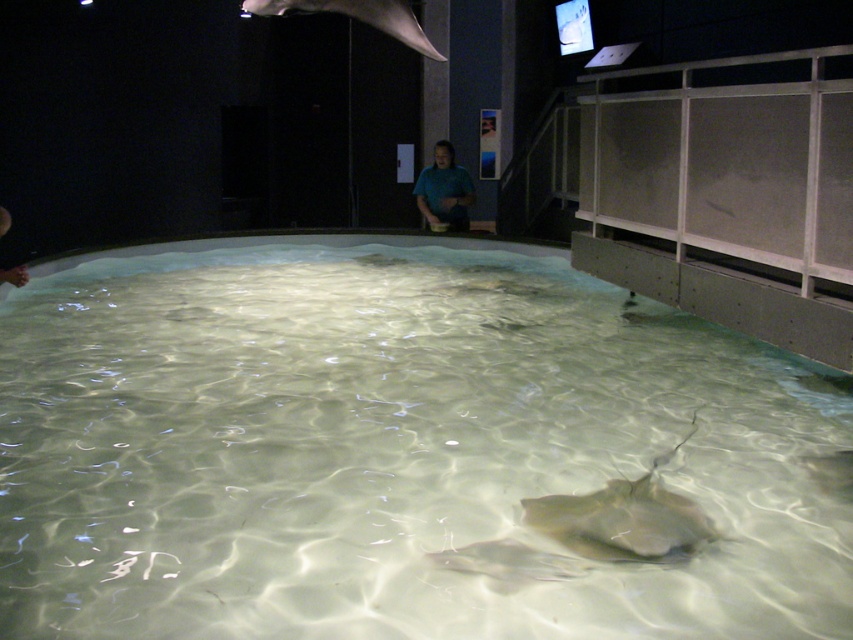
You are a marine biologist observing the aquarium. You notice two stingrays in the pool. Which stingray, the translucent white stingray at center or the smooth gray stingray at upper center, is closer to the bottom of the pool?

The translucent white stingray at center is closer to the bottom of the pool because it has a lesser height compared to the smooth gray stingray at upper center.

You are a visitor at the aquarium and want to take a photo of the translucent white stingray at center through the clear glass swimming pool at center. Since the pool is bigger, will you need to adjust your camera focus to capture the stingray clearly?

The clear glass swimming pool at center is bigger than the translucent white stingray at center, so you will need to adjust your camera focus to ensure the stingray is in focus while accounting for the larger pool area.

You are standing in the aquarium exhibit and want to take a photo of the clear glass swimming pool at center. Where should you position yourself to capture the best view?

The clear glass swimming pool at center is located at point (393, 449), so you should position yourself directly in front of that coordinate to capture the best view.